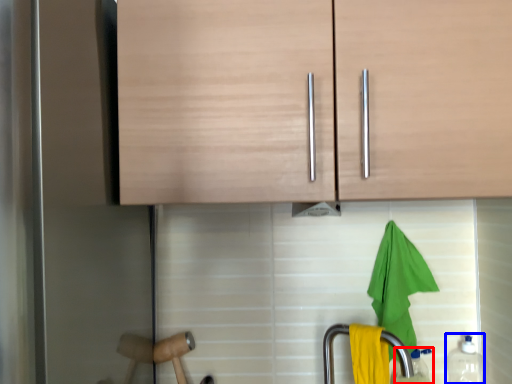
Question: Which of the following is the farthest to the observer, bottle (highlighted by a red box) or bottle (highlighted by a blue box)?

Choices:
 (A) bottle
 (B) bottle

Answer: (A)